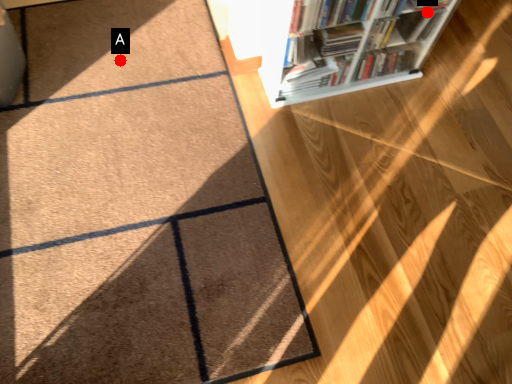
Question: Two points are circled on the image, labeled by A and B beside each circle. Which point is farther from the camera taking this photo?

Choices:
 (A) A is further
 (B) B is further

Answer: (A)